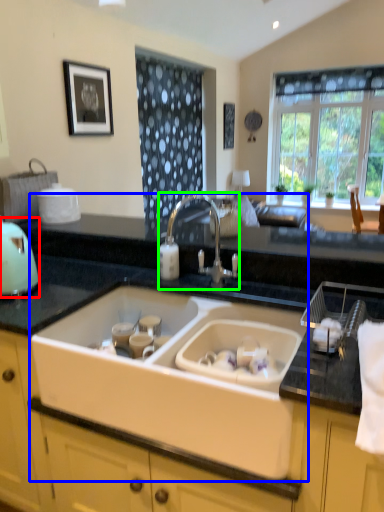
Question: Which object is the farthest from appliance (highlighted by a red box)? Choose among these: sink (highlighted by a blue box) or tap (highlighted by a green box).

Choices:
 (A) sink
 (B) tap

Answer: (B)